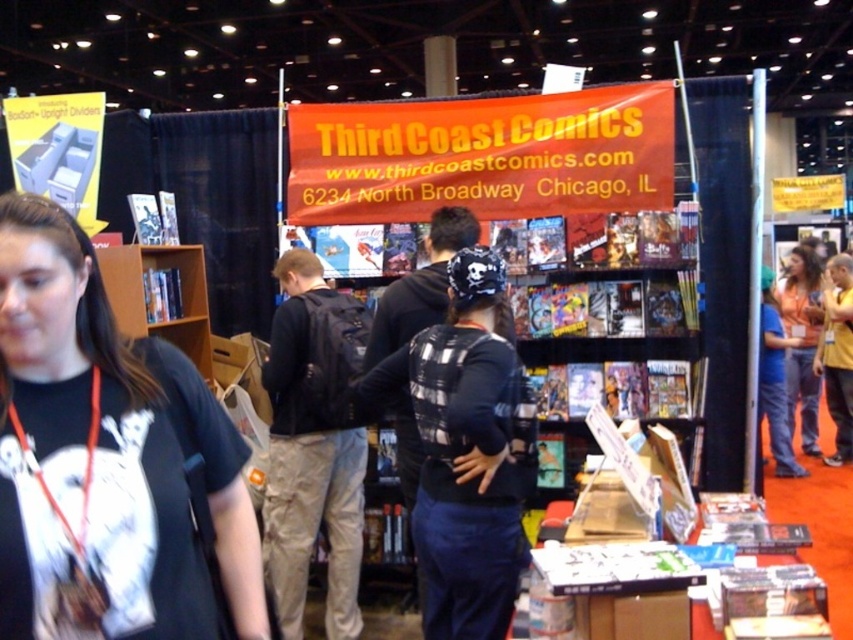
You are a photographer at the event and need to capture both the black plaid shirt at center and the orange fabric at right in a single frame. Which object should you focus on first to ensure both are in the frame?

The black plaid shirt at center is shorter than the orange fabric at right, so you should focus on the orange fabric at right first to ensure both are in the frame.

You are an attendee at the convention and want to approach the booth. There is a black plaid shirt at center and an orange fabric at right in your way. Which object is closer to you as you approach the booth?

The black plaid shirt at center is closer to you because it is positioned under the orange fabric at right, indicating it is in front.

From the picture: You are attending a comic convention and notice two items at the Third Coast Comics booth. The first is a black plaid shirt at center, and the second is an orange fabric at right. Which item is narrower?

The black plaid shirt at center is narrower than the orange fabric at right.